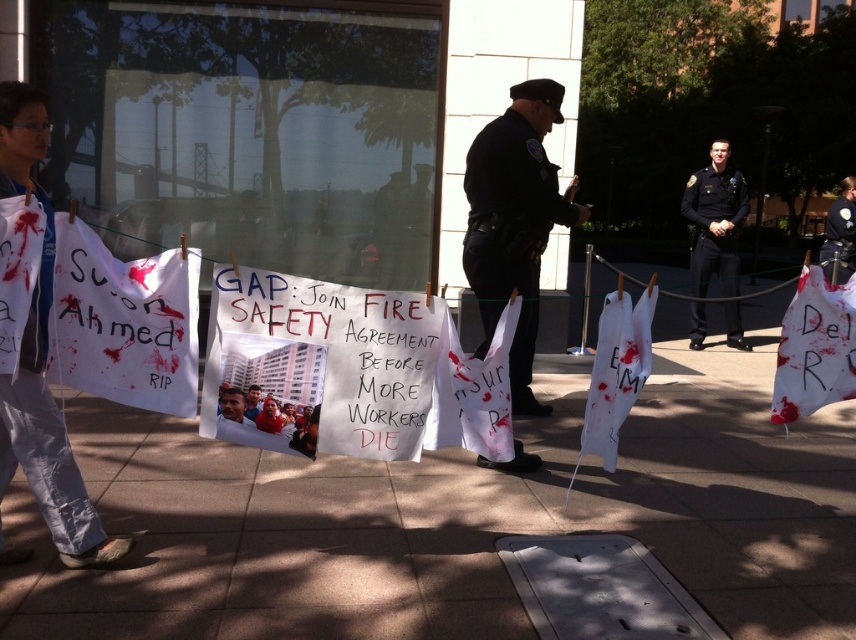
You are a photographer standing at the edge of the protest scene. You want to capture a photo of the matte white shirt at center without the brown concrete pavement at lower center appearing in the foreground. Is this possible based on their positions?

The brown concrete pavement at lower center is in front of the matte white shirt at center, so it will block the view. To avoid the pavement in the foreground, you would need to adjust your angle or move to a position where the pavement is not between you and the shirt.

You are a photographer trying to capture the protest scene. You notice the brown concrete pavement at lower center and the matte white shirt at center. Which object is closer to the camera?

The matte white shirt at center is closer to the camera because the brown concrete pavement at lower center is positioned under it.